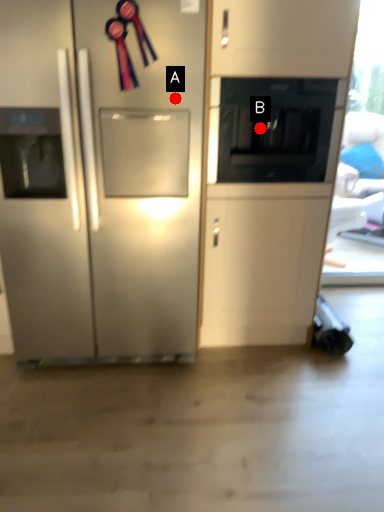
Question: Two points are circled on the image, labeled by A and B beside each circle. Which point appears farthest from the camera in this image?

Choices:
 (A) A is further
 (B) B is further

Answer: (B)